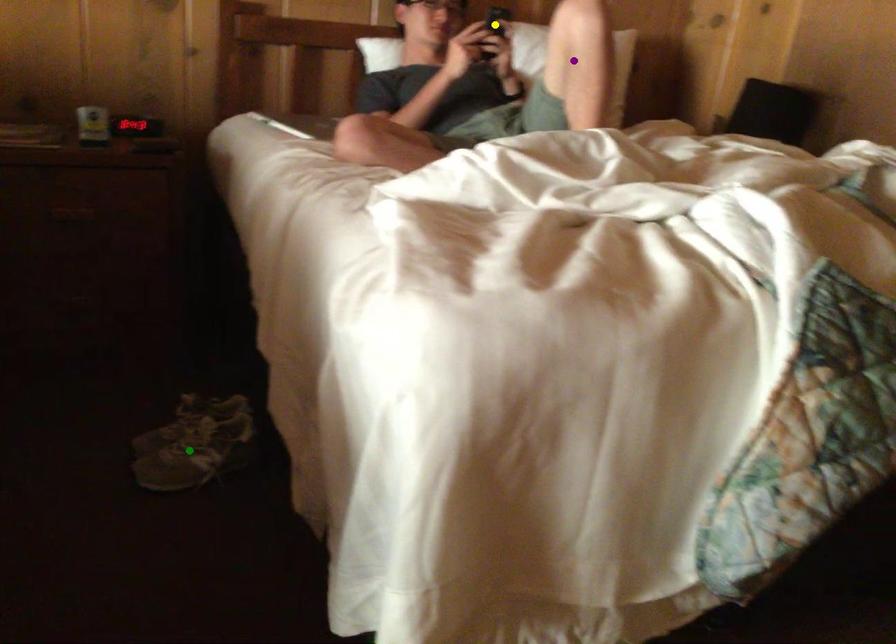
Order these from nearest to farthest:
purple point | yellow point | green point

green point → yellow point → purple point